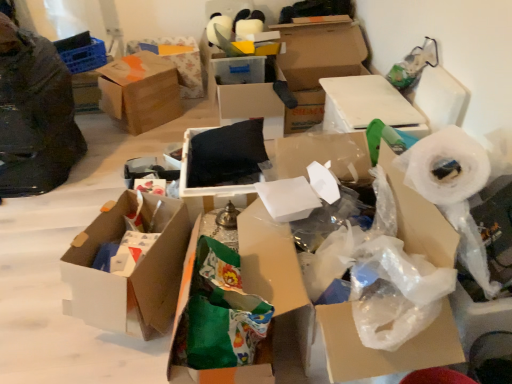
Question: Which direction should I rotate to look at white cardboard box at center, positioned as the 6th box in right-to-left order?

Choices:
 (A) left
 (B) right

Answer: (A)

Question: Considering the relative positions of white cardboard box at center, which appears as the sixth box when viewed from the left, and cardboard box at upper center, arranged as the 7th box when viewed from the left, in the image provided, is white cardboard box at center, which appears as the sixth box when viewed from the left, behind cardboard box at upper center, arranged as the 7th box when viewed from the left,?

Choices:
 (A) yes
 (B) no

Answer: (B)

Question: Is white cardboard box at center, which ranks as the third box in right-to-left order, shorter than cardboard box at upper center, which ranks as the second box in right-to-left order?

Choices:
 (A) no
 (B) yes

Answer: (B)

Question: Considering the relative positions of white cardboard box at center, which ranks as the third box in right-to-left order, and cardboard box at upper center, arranged as the 7th box when viewed from the left, in the image provided, is white cardboard box at center, which ranks as the third box in right-to-left order, to the right of cardboard box at upper center, arranged as the 7th box when viewed from the left, from the viewer's perspective?

Choices:
 (A) no
 (B) yes

Answer: (A)

Question: From the image's perspective, is white cardboard box at center, which appears as the sixth box when viewed from the left, over cardboard box at upper center, arranged as the 7th box when viewed from the left?

Choices:
 (A) yes
 (B) no

Answer: (B)

Question: Is white cardboard box at center, which ranks as the third box in right-to-left order, thinner than cardboard box at upper center, which ranks as the second box in right-to-left order?

Choices:
 (A) no
 (B) yes

Answer: (B)

Question: Does white cardboard box at center, which appears as the sixth box when viewed from the left, have a greater height compared to cardboard box at upper center, which ranks as the second box in right-to-left order?

Choices:
 (A) no
 (B) yes

Answer: (A)

Question: Is green fabric bag at center, acting as the 5th box starting from the left, thinner than black matte pillow at center, acting as the 4th box starting from the left?

Choices:
 (A) no
 (B) yes

Answer: (B)

Question: Can we say green fabric bag at center, acting as the 5th box starting from the left, lies outside black matte pillow at center, acting as the 4th box starting from the left?

Choices:
 (A) yes
 (B) no

Answer: (A)

Question: Is green fabric bag at center, which ranks as the 4th box in right-to-left order, positioned with its back to black matte pillow at center, the 5th box from the right?

Choices:
 (A) no
 (B) yes

Answer: (A)

Question: Does green fabric bag at center, which ranks as the 4th box in right-to-left order, have a larger size compared to black matte pillow at center, acting as the 4th box starting from the left?

Choices:
 (A) no
 (B) yes

Answer: (B)

Question: Are green fabric bag at center, which ranks as the 4th box in right-to-left order, and black matte pillow at center, the 5th box from the right, far apart?

Choices:
 (A) no
 (B) yes

Answer: (A)

Question: Could black matte pillow at center, acting as the 4th box starting from the left, be considered to be inside green fabric bag at center, acting as the 5th box starting from the left?

Choices:
 (A) yes
 (B) no

Answer: (B)

Question: From the image's perspective, is cardboard box at upper center, which ranks as the second box in right-to-left order, located beneath white plastic roll at right?

Choices:
 (A) yes
 (B) no

Answer: (B)